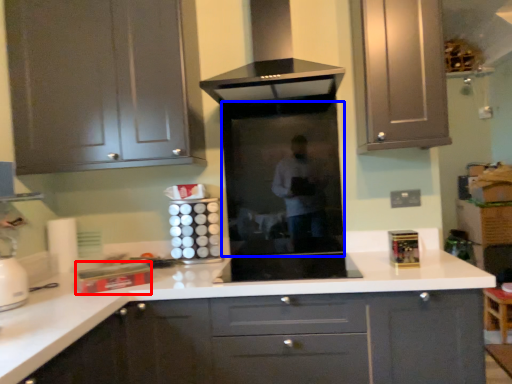
Question: Which object is further to the camera taking this photo, appliance (highlighted by a red box) or glass door (highlighted by a blue box)?

Choices:
 (A) appliance
 (B) glass door

Answer: (B)